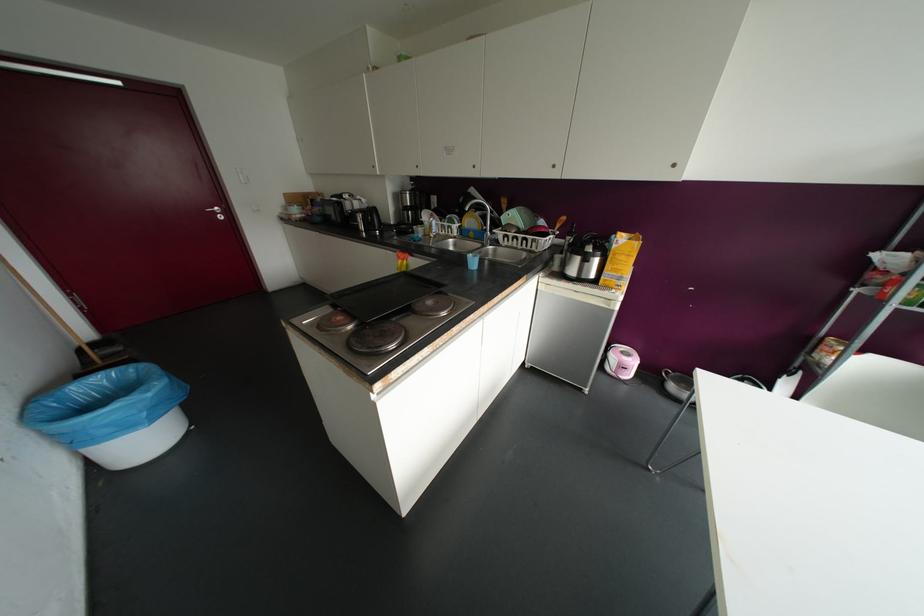
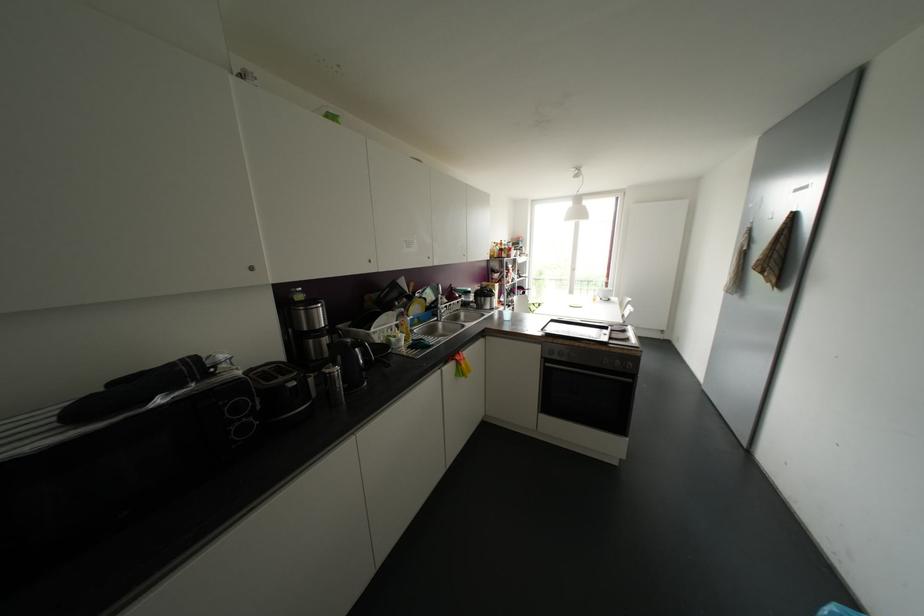
The point at [441,284] is marked in the first image. Where is the corresponding point in the second image?

(553, 317)